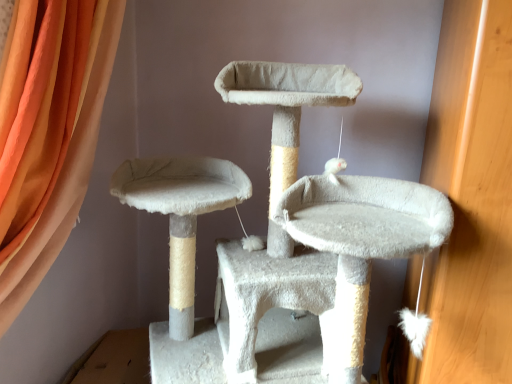
Question: Can you confirm if white fluffy cat furniture at center is bigger than orange fabric curtain at upper left?

Choices:
 (A) no
 (B) yes

Answer: (B)

Question: Does white fluffy cat furniture at center come behind orange fabric curtain at upper left?

Choices:
 (A) yes
 (B) no

Answer: (B)

Question: From the image's perspective, would you say white fluffy cat furniture at center is positioned over orange fabric curtain at upper left?

Choices:
 (A) no
 (B) yes

Answer: (A)

Question: Is white fluffy cat furniture at center not close to orange fabric curtain at upper left?

Choices:
 (A) yes
 (B) no

Answer: (B)

Question: Is the position of white fluffy cat furniture at center less distant than that of orange fabric curtain at upper left?

Choices:
 (A) no
 (B) yes

Answer: (B)

Question: Does white fluffy cat furniture at center touch orange fabric curtain at upper left?

Choices:
 (A) yes
 (B) no

Answer: (B)

Question: Is orange fabric curtain at upper left thinner than white fluffy cat furniture at center?

Choices:
 (A) yes
 (B) no

Answer: (A)

Question: Is orange fabric curtain at upper left facing towards white fluffy cat furniture at center?

Choices:
 (A) no
 (B) yes

Answer: (B)

Question: From the image's perspective, is orange fabric curtain at upper left under white fluffy cat furniture at center?

Choices:
 (A) no
 (B) yes

Answer: (A)

Question: Is orange fabric curtain at upper left facing away from white fluffy cat furniture at center?

Choices:
 (A) yes
 (B) no

Answer: (B)

Question: Does orange fabric curtain at upper left have a greater width compared to white fluffy cat furniture at center?

Choices:
 (A) yes
 (B) no

Answer: (B)

Question: Can white fluffy cat furniture at center be found inside orange fabric curtain at upper left?

Choices:
 (A) yes
 (B) no

Answer: (B)

Question: Based on their sizes in the image, would you say white fluffy cat furniture at center is bigger or smaller than orange fabric curtain at upper left?

Choices:
 (A) big
 (B) small

Answer: (A)